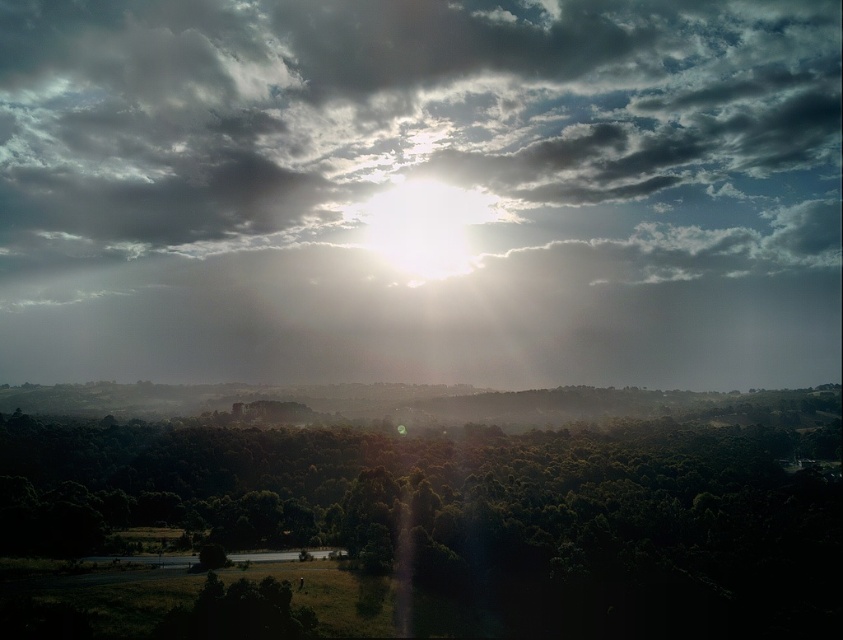
Based on the photo, can you confirm if cloudy at upper center is positioned above green leafy tree at center?

Indeed, cloudy at upper center is positioned over green leafy tree at center.

Based on the photo, is cloudy at upper center shorter than green leafy tree at center?

No, cloudy at upper center is not shorter than green leafy tree at center.

Locate an element on the screen. The image size is (843, 640). cloudy at upper center is located at coordinates (420, 189).